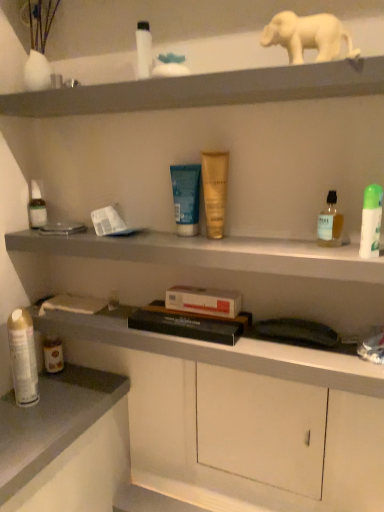
At what (x,y) coordinates should I click in order to perform the action: click on vacant area on top of hardcover book at center (from a real-world perspective). Please return your answer as a coordinate pair (x, y). This screenshot has height=512, width=384. Looking at the image, I should click on (187, 319).